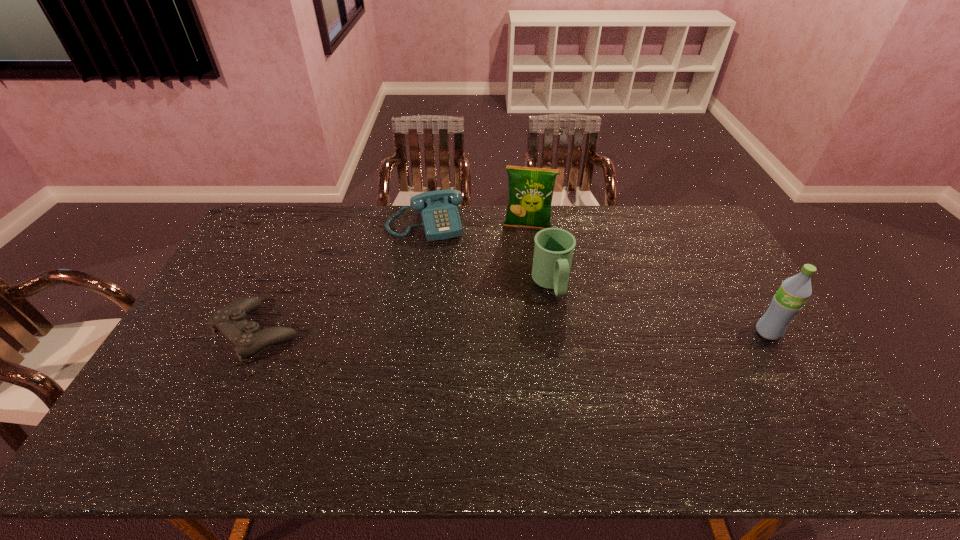
Identify the location of free space on the desktop that is between the leftmost object and the rightmost object and is positioned on the front-facing side of the crisp (potato chip). (515, 332).

This screenshot has height=540, width=960. In order to click on free space on the desktop that is between the control and the rightmost object and is positioned on the side of the mug with the handle in this screenshot , I will do `click(569, 332)`.

This screenshot has height=540, width=960. I want to click on vacant space on the desktop that is between the shortest object and the water bottle and is positioned on the dial of the second shortest object, so click(456, 333).